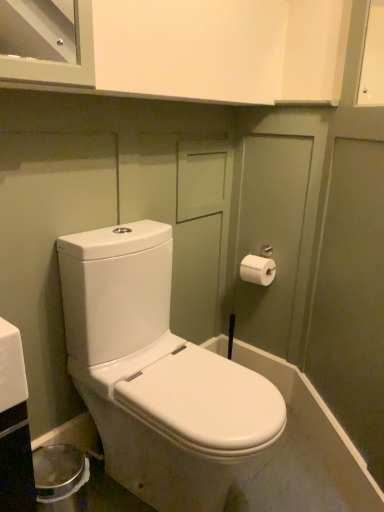
Question: From their relative heights in the image, would you say white glossy toilet at center is taller or shorter than white matte toilet paper at right?

Choices:
 (A) tall
 (B) short

Answer: (A)

Question: From a real-world perspective, is white glossy toilet at center positioned above or below white matte toilet paper at right?

Choices:
 (A) below
 (B) above

Answer: (A)

Question: Visually, is white glossy toilet at center positioned to the left or to the right of white matte toilet paper at right?

Choices:
 (A) right
 (B) left

Answer: (B)

Question: Looking at their shapes, would you say white matte toilet paper at right is wider or thinner than white glossy toilet at center?

Choices:
 (A) thin
 (B) wide

Answer: (A)

Question: From the image's perspective, is white matte toilet paper at right positioned above or below white glossy toilet at center?

Choices:
 (A) below
 (B) above

Answer: (B)

Question: Based on their positions, is white matte toilet paper at right located to the left or right of white glossy toilet at center?

Choices:
 (A) left
 (B) right

Answer: (B)

Question: Is white matte toilet paper at right in front of or behind white glossy toilet at center in the image?

Choices:
 (A) front
 (B) behind

Answer: (B)